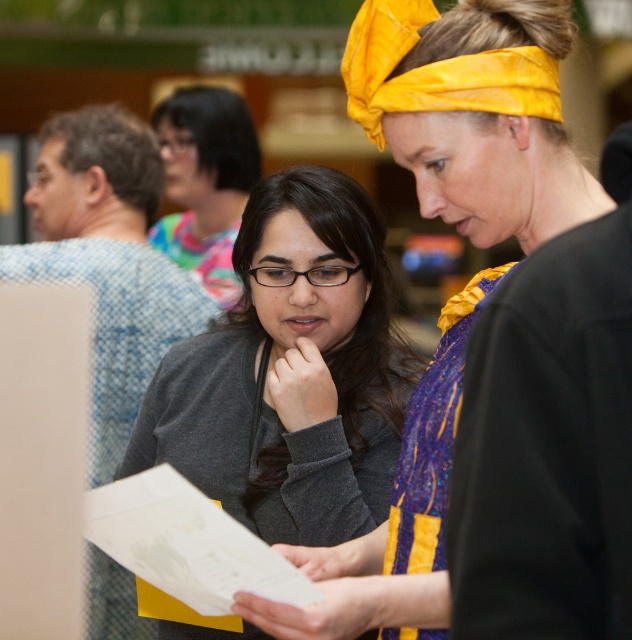
In the scene shown: You are designing a display stand for a clothing store and need to arrange two sweaters. The matte black sweater at center and the gray matte sweater at center must be placed on the same shelf. Given that the shelf has limited vertical space, which sweater should be placed at the back to ensure both are visible?

The matte black sweater at center is much taller than the gray matte sweater at center, so placing the taller matte black sweater at center at the back would allow the shorter gray matte sweater at center to be visible in front of it.

You are a photographer who needs to adjust the focus of your camera to capture the matte black sweater at center clearly. Given that the camera and the sweater are 1.84 meters apart, what is the minimum distance you should set the camera lens to ensure the sweater is in focus?

The minimum distance you should set the camera lens is 1.84 meters to ensure the matte black sweater at center is in focus, as they are exactly that distance apart.